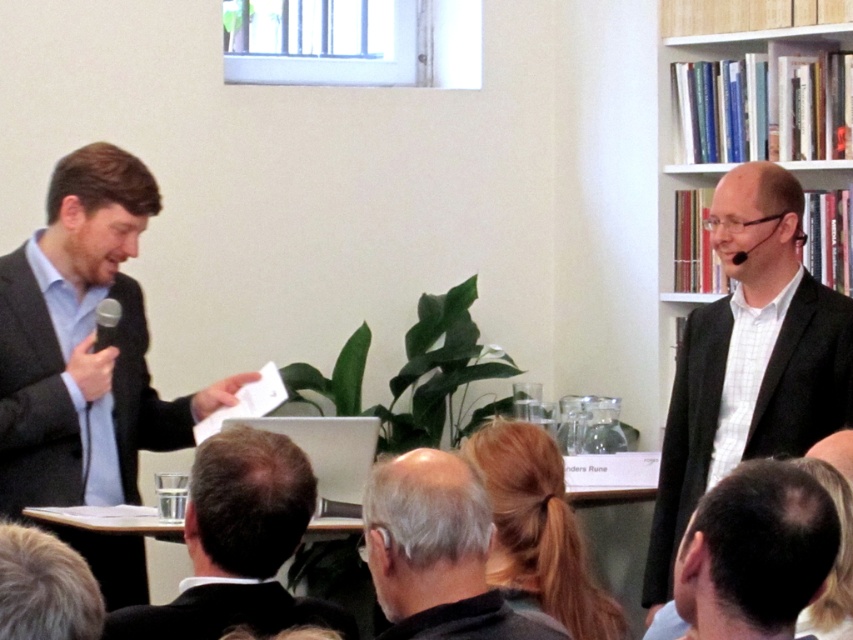
You are organizing a presentation and need to choose between the black matte microphone at left and the black matte microphone at upper right. Which one is more suitable if you prefer a thinner design?

The black matte microphone at left is thinner than the black matte microphone at upper right, so it is more suitable for a thinner design preference.

You are an attendee at the conference and want to place a new book on the white glossy bookshelf at upper right. To do so, you need to walk from your current position near the black matte suit at lower center. In which direction should you move to reach the bookshelf?

The white glossy bookshelf at upper right is located to the right of the black matte suit at lower center, so you should move to your right to reach it.